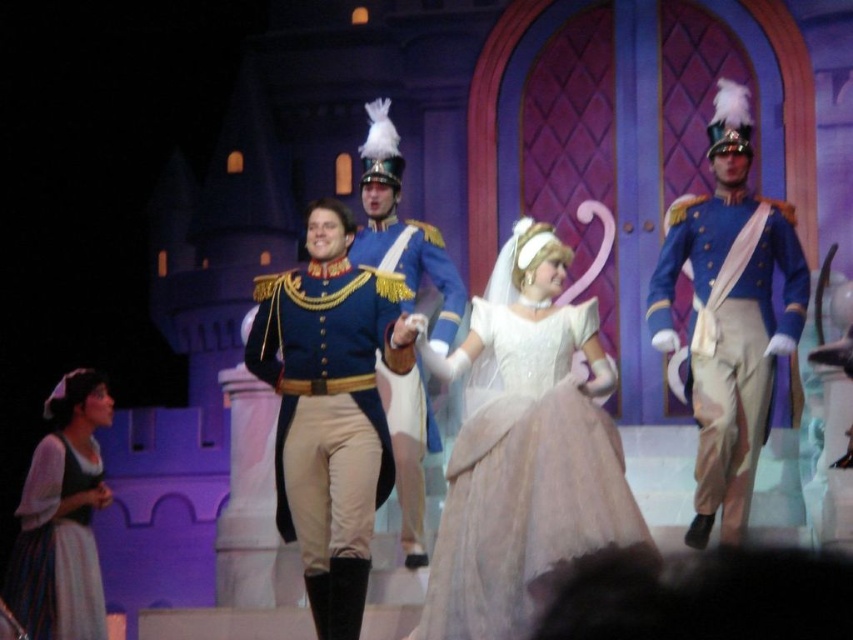
The height and width of the screenshot is (640, 853). I want to click on blue satin jacket at center, so click(x=329, y=419).

Where is `blue satin jacket at center`? The height and width of the screenshot is (640, 853). blue satin jacket at center is located at coordinates (329, 419).

Who is higher up, white satin dress at center or blue satin uniform at center?

Positioned higher is blue satin uniform at center.

Which is in front, point (511, 604) or point (415, 374)?

Point (511, 604) is in front.

Locate an element on the screen. white satin dress at center is located at coordinates (523, 449).

Who is more forward, (x=44, y=604) or (x=390, y=144)?

Point (x=44, y=604)

Can you confirm if white cotton dress at lower left is positioned to the right of blue satin uniform at center?

In fact, white cotton dress at lower left is to the left of blue satin uniform at center.

The height and width of the screenshot is (640, 853). In order to click on white cotton dress at lower left in this screenshot , I will do `click(62, 516)`.